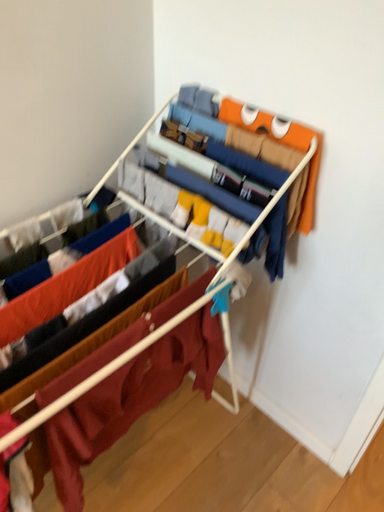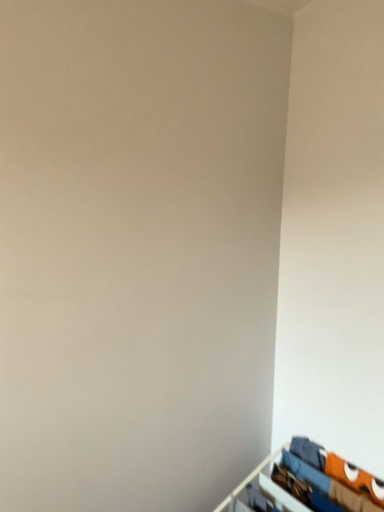
Question: How did the camera likely rotate when shooting the video?

Choices:
 (A) rotated right
 (B) rotated left

Answer: (B)